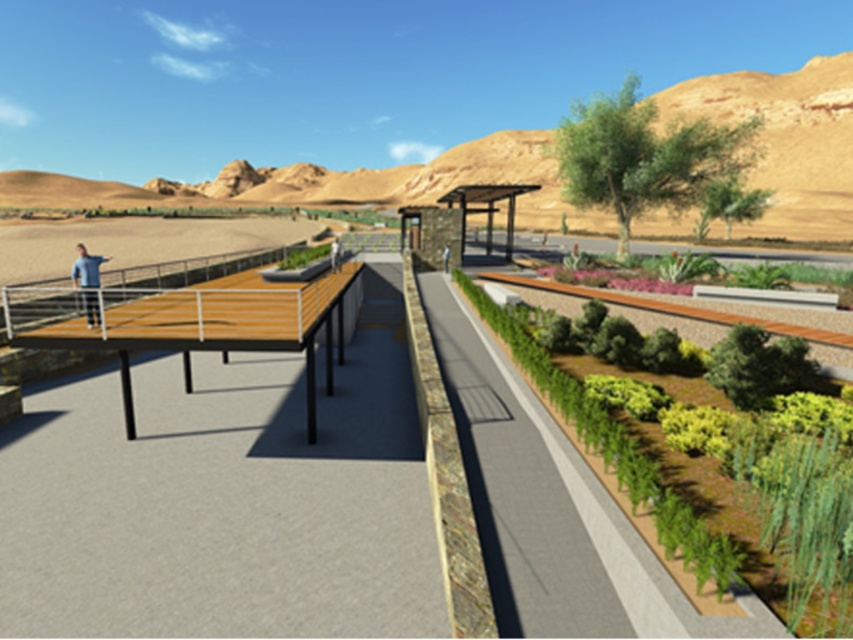
Question: Which of the following is the closest to the observer?

Choices:
 (A) (28, 406)
 (B) (700, 540)
 (C) (193, 301)

Answer: (B)

Question: Considering the relative positions of green leafy shrubs at center right and blue fabric shirt at left in the image provided, where is green leafy shrubs at center right located with respect to blue fabric shirt at left?

Choices:
 (A) below
 (B) above

Answer: (A)

Question: From the image, what is the correct spatial relationship of green leafy shrubs at center right in relation to blue fabric shirt at left?

Choices:
 (A) right
 (B) left

Answer: (A)

Question: Which point appears closest to the camera in this image?

Choices:
 (A) (225, 278)
 (B) (76, 260)

Answer: (B)

Question: Does green leafy shrubs at center right have a smaller size compared to blue fabric shirt at left?

Choices:
 (A) no
 (B) yes

Answer: (B)

Question: Considering the real-world distances, which object is farthest from the green leafy shrubs at center right?

Choices:
 (A) blue fabric shirt at left
 (B) wooden deck at left

Answer: (A)